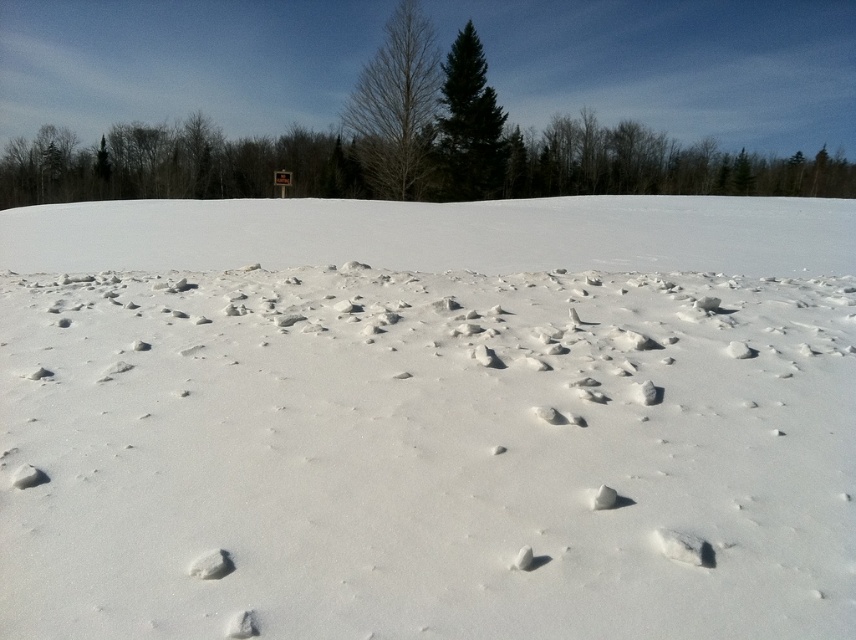
Is white matte snow at center shorter than green glossy evergreen tree at center?

Yes, white matte snow at center is shorter than green glossy evergreen tree at center.

Between point (453, 461) and point (482, 125), which one is positioned behind?

Positioned behind is point (482, 125).

Where is `white matte snow at center`? white matte snow at center is located at coordinates (428, 419).

Is white matte snow at center taller than brown matte tree at center?

No.

Is white matte snow at center smaller than brown matte tree at center?

Correct, white matte snow at center occupies less space than brown matte tree at center.

Which is in front, point (379, 593) or point (420, 88)?

Point (379, 593) is more forward.

This screenshot has height=640, width=856. Identify the location of white matte snow at center. (428, 419).

Is brown matte tree at center closer to camera compared to green glossy evergreen tree at center?

Yes, it is.

Does point (385, 116) come farther from viewer compared to point (491, 195)?

No, (385, 116) is closer to viewer.

What are the coordinates of `brown matte tree at center` in the screenshot? It's located at (396, 104).